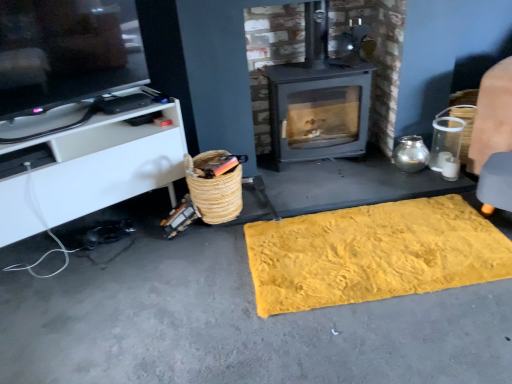
Image resolution: width=512 pixels, height=384 pixels. In order to click on free location in front of white matte cabinet at left in this screenshot , I will do `click(106, 309)`.